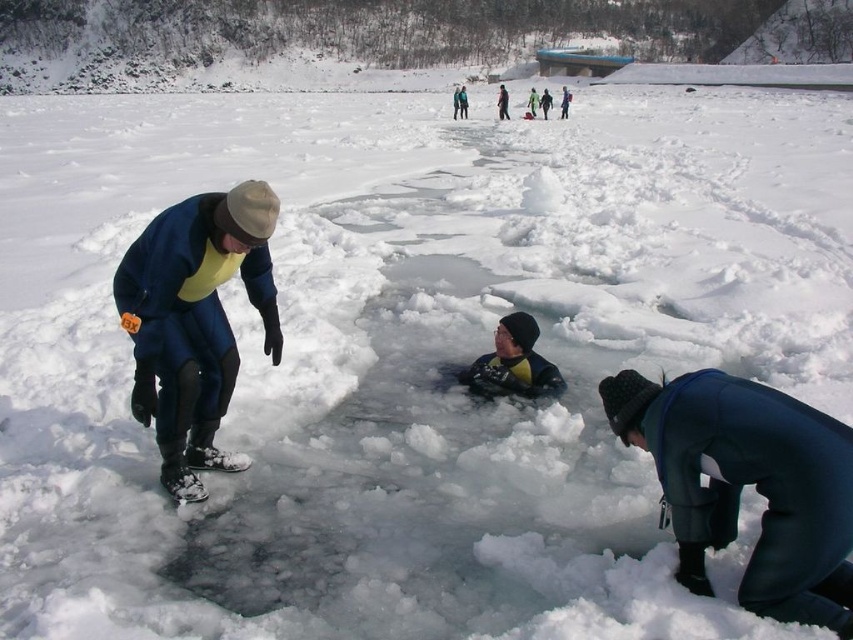
You are a lifeguard on the frozen lake. You see the matte blue snowsuit at left and the yellow rubber suit at center. Which one is lower in position?

The matte blue snowsuit at left is below the yellow rubber suit at center, so it is lower in position.